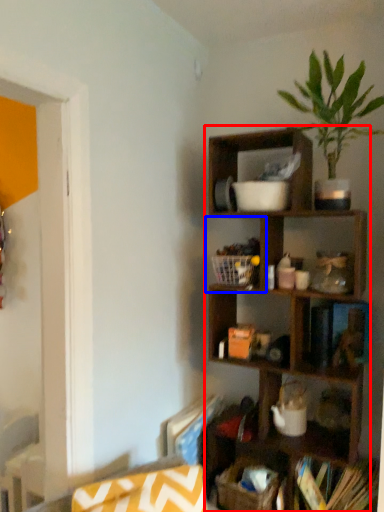
Question: Which object is further to the camera taking this photo, shelf (highlighted by a red box) or cabinet (highlighted by a blue box)?

Choices:
 (A) shelf
 (B) cabinet

Answer: (B)